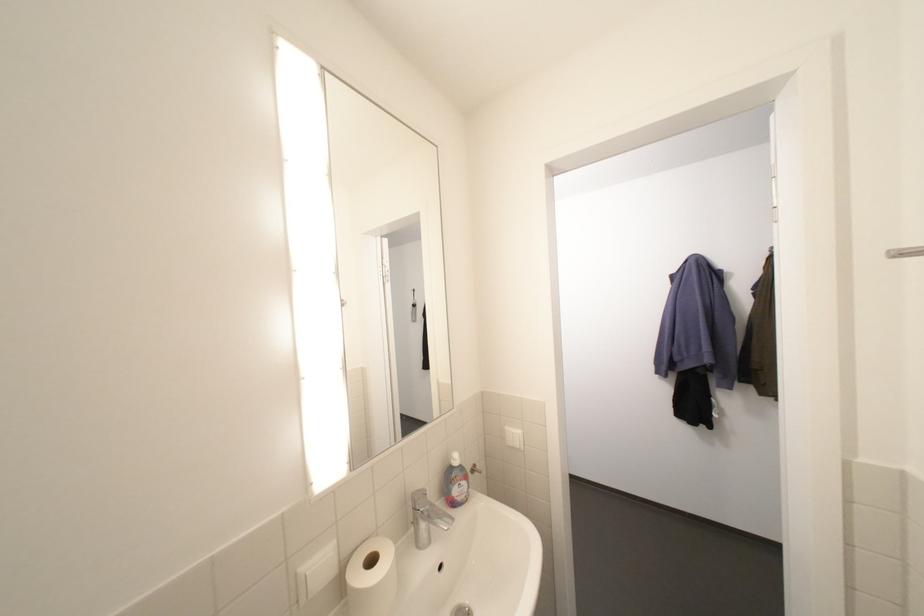
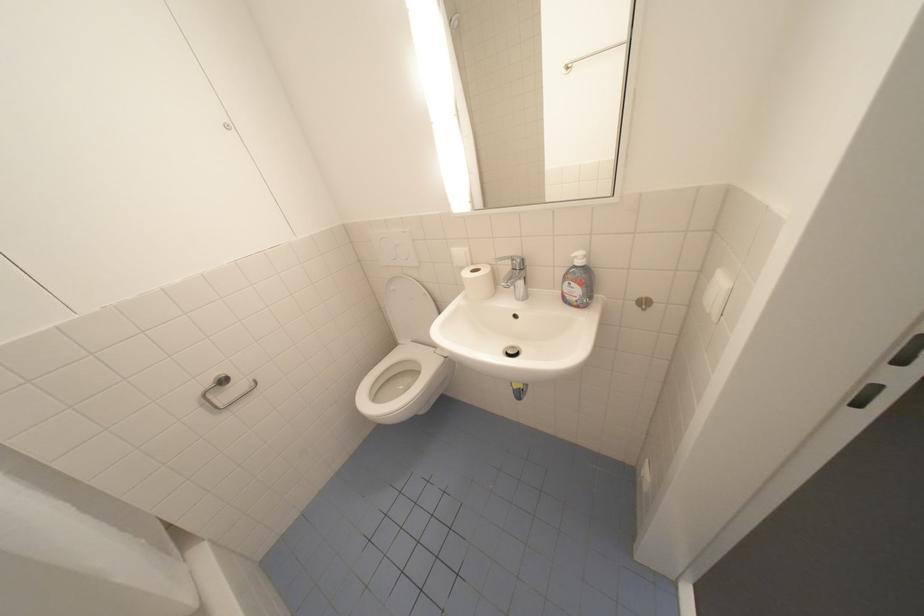
How did the camera likely rotate?

The camera's rotation is toward left-down.